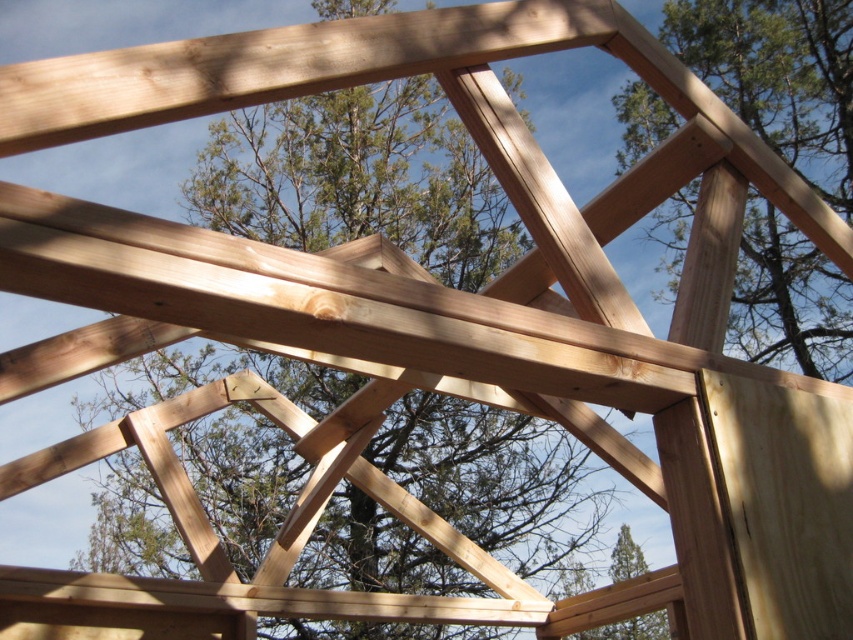
You are an architect inspecting a construction site. You notice a point marked at coordinates [358,179]. What object is located at this point?

The point at coordinates [358,179] is occupied by a natural wood tree at center.

You are an architect inspecting a construction site. You notice two wooden elements in the framework. Which one is shorter between the natural wood tree at center and the natural wood post at upper right?

The natural wood tree at center is shorter than the natural wood post at upper right.

You are standing at the construction site and want to place a 40 feet long wooden beam between the natural wood tree at center and yourself. Is the distance sufficient for placing the beam?

The distance between the natural wood tree at center and the viewer is 38.74 feet, which is shorter than the 40 feet long wooden beam. Therefore, the beam cannot be placed between them as it would exceed the available space.